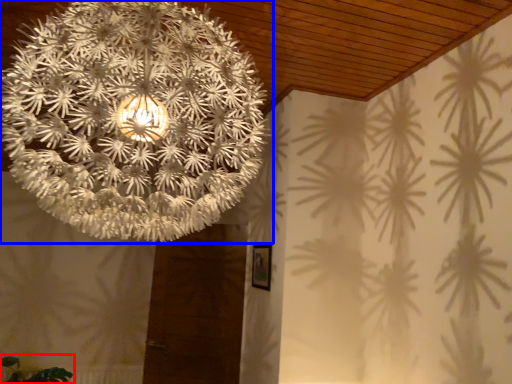
Question: Which object is further to the camera taking this photo, plant (highlighted by a red box) or lamp (highlighted by a blue box)?

Choices:
 (A) plant
 (B) lamp

Answer: (A)